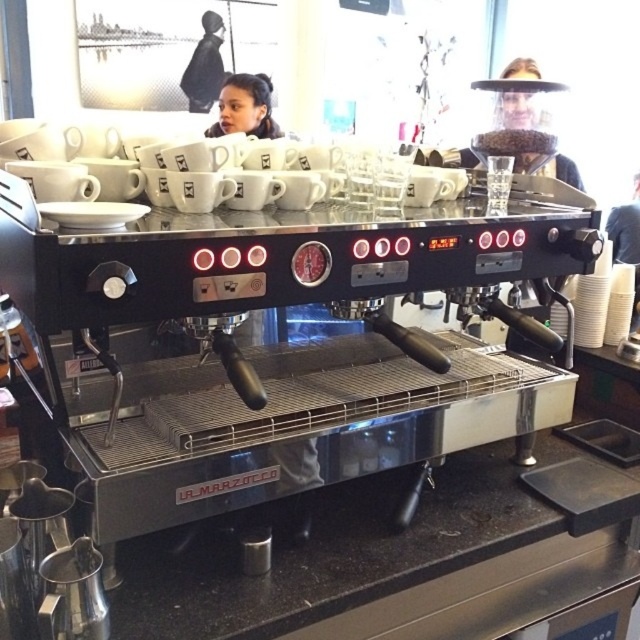
Which is in front, point (556, 593) or point (545, 173)?

Positioned in front is point (556, 593).

Between black granite countertop at lower center and clear plastic face shield at upper center, which one appears on the right side from the viewer's perspective?

From the viewer's perspective, clear plastic face shield at upper center appears more on the right side.

What do you see at coordinates (381, 561) in the screenshot?
I see `black granite countertop at lower center` at bounding box center [381, 561].

Locate an element on the screen. black granite countertop at lower center is located at coordinates (381, 561).